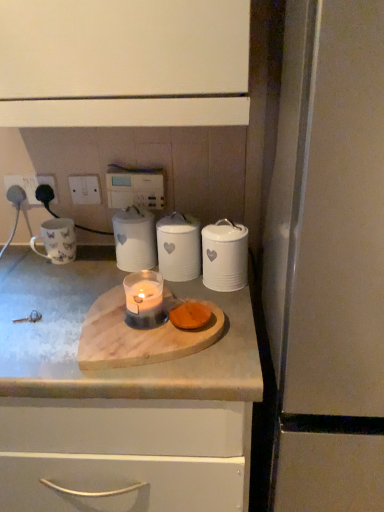
Identify the location of free region on the left part of translucent glass candle at center. This screenshot has width=384, height=512. (43, 324).